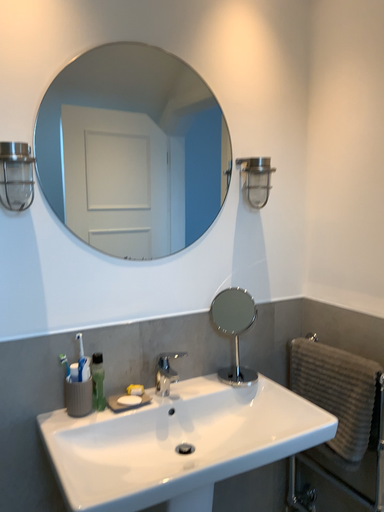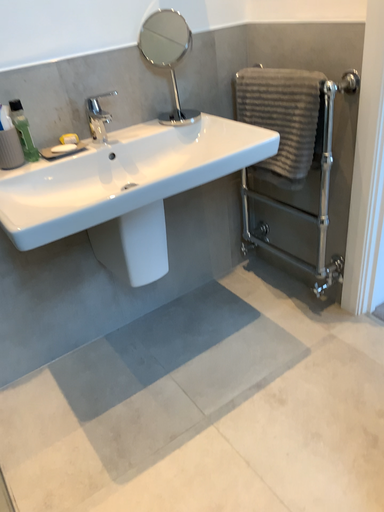
Question: How did the camera likely rotate when shooting the video?

Choices:
 (A) rotated upward
 (B) rotated downward

Answer: (B)